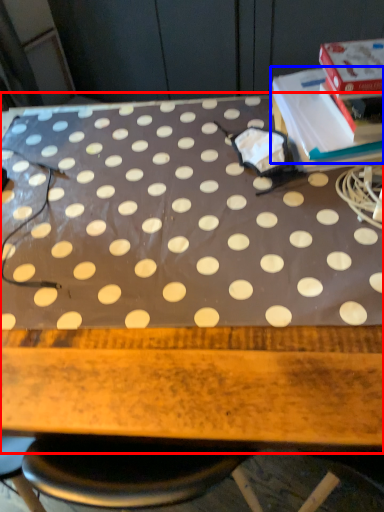
Question: Which object appears closest to the camera in this image, table (highlighted by a red box) or paperback book (highlighted by a blue box)?

Choices:
 (A) table
 (B) paperback book

Answer: (A)